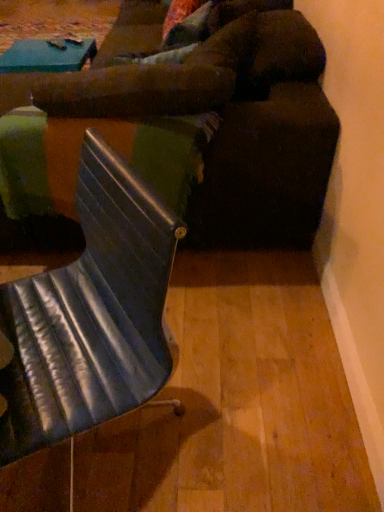
Find the location of `metallic blue chair at center`. metallic blue chair at center is located at coordinates (91, 314).

Describe the element at coordinates (227, 120) in the screenshot. Image resolution: width=384 pixels, height=512 pixels. I see `velvet brown couch at center` at that location.

At what (x,y) coordinates should I click in order to perform the action: click on metallic blue chair at center. Please return your answer as a coordinate pair (x, y). Image resolution: width=384 pixels, height=512 pixels. Looking at the image, I should click on (91, 314).

Does point (121, 150) lie in front of point (234, 208)?

Yes, it is in front of point (234, 208).

From a real-world perspective, is metallic silver table at center above or below velvet brown couch at center?

Clearly, from a real-world perspective, metallic silver table at center is below velvet brown couch at center.

Is metallic silver table at center wider than velvet brown couch at center?

Incorrect, the width of metallic silver table at center does not surpass that of velvet brown couch at center.

Is metallic silver table at center facing towards velvet brown couch at center?

Yes, metallic silver table at center is aimed at velvet brown couch at center.

Considering the points (31, 307) and (305, 66), which point is in front, point (31, 307) or point (305, 66)?

Positioned in front is point (31, 307).

Considering the sizes of objects metallic blue chair at center and velvet brown couch at center in the image provided, who is thinner, metallic blue chair at center or velvet brown couch at center?

With smaller width is metallic blue chair at center.

Between metallic blue chair at center and velvet brown couch at center, which one is positioned behind?

velvet brown couch at center is more distant.

Is metallic silver table at center at the left side of metallic blue chair at center?

Yes.

Looking at this image, how different are the orientations of metallic silver table at center and metallic blue chair at center in degrees?

They differ by 34.5 degrees in their facing directions.

Is metallic silver table at center facing away from metallic blue chair at center?

No, metallic silver table at center's orientation is not away from metallic blue chair at center.

Is metallic silver table at center directly adjacent to metallic blue chair at center?

No, metallic silver table at center is not with metallic blue chair at center.

Could you tell me if velvet brown couch at center is facing metallic silver table at center?

No.

Which object is further away from the camera, velvet brown couch at center or metallic silver table at center?

metallic silver table at center is further from the camera.

Does velvet brown couch at center have a greater width compared to metallic silver table at center?

Yes.

Is point (159, 229) more distant than point (25, 156)?

No, (159, 229) is in front of (25, 156).

Locate an element on the screen. The image size is (384, 512). chair that appears below the metallic silver table at center (from the image's perspective) is located at coordinates (91, 314).

Based on the photo, does metallic blue chair at center have a lesser height compared to metallic silver table at center?

In fact, metallic blue chair at center may be taller than metallic silver table at center.

Is velvet brown couch at center aimed at metallic blue chair at center?

No, velvet brown couch at center is not turned towards metallic blue chair at center.

Considering the positions of objects velvet brown couch at center and metallic blue chair at center in the image provided, who is in front, velvet brown couch at center or metallic blue chair at center?

metallic blue chair at center.

Locate an element on the screen. chair that is under the velvet brown couch at center (from a real-world perspective) is located at coordinates (91, 314).

Locate an element on the screen. The height and width of the screenshot is (512, 384). table below the velvet brown couch at center (from the image's perspective) is located at coordinates [79, 159].

You are a GUI agent. You are given a task and a screenshot of the screen. Output one action in this format:
    pyautogui.click(x=<x>, y=<y>)
    Task: Click on the studio couch on the right of the metallic blue chair at center
    
    Given the screenshot: What is the action you would take?
    [x=227, y=120]

From the image, which object appears to be farther from velvet brown couch at center, metallic silver table at center or metallic blue chair at center?

Among the two, metallic blue chair at center is located further to velvet brown couch at center.

When comparing their distances from metallic silver table at center, does metallic blue chair at center or velvet brown couch at center seem further?

Based on the image, metallic blue chair at center appears to be further to metallic silver table at center.

Looking at the image, which one is located further to metallic blue chair at center, velvet brown couch at center or metallic silver table at center?

Based on the image, velvet brown couch at center appears to be further to metallic blue chair at center.

Estimate the real-world distances between objects in this image. Which object is further from metallic blue chair at center, metallic silver table at center or velvet brown couch at center?

velvet brown couch at center lies further to metallic blue chair at center than the other object.

From the image, which object appears to be farther from metallic silver table at center, velvet brown couch at center or metallic blue chair at center?

metallic blue chair at center is further to metallic silver table at center.

From the image, which object appears to be farther from velvet brown couch at center, metallic blue chair at center or metallic silver table at center?

Among the two, metallic blue chair at center is located further to velvet brown couch at center.

At what (x,y) coordinates should I click in order to perform the action: click on table between velvet brown couch at center and metallic blue chair at center in the vertical direction. Please return your answer as a coordinate pair (x, y). Looking at the image, I should click on (79, 159).